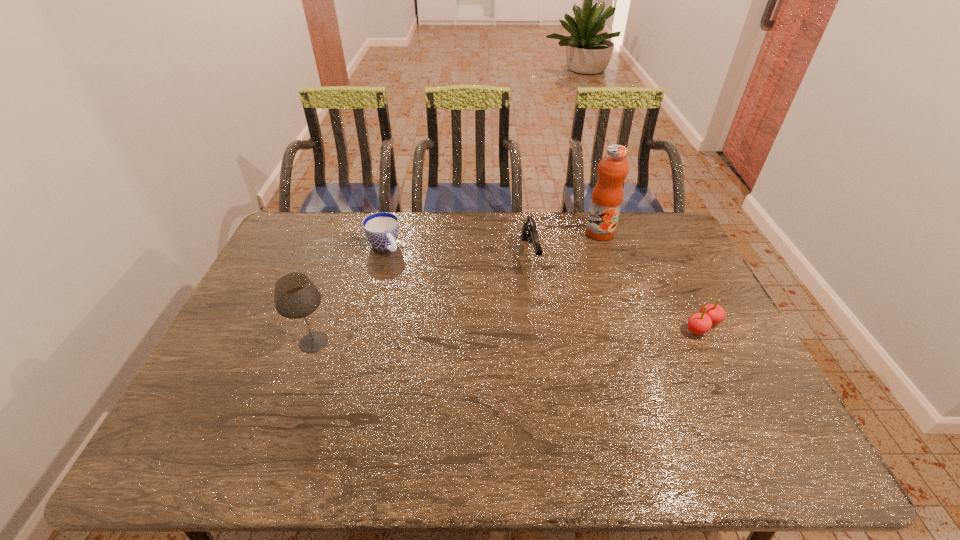
Image resolution: width=960 pixels, height=540 pixels. Find the location of `the leftmost object`. the leftmost object is located at coordinates (295, 296).

The height and width of the screenshot is (540, 960). Find the location of `the second tallest object`. the second tallest object is located at coordinates (295, 296).

Identify the location of the rightmost object. This screenshot has width=960, height=540. [x=699, y=323].

The height and width of the screenshot is (540, 960). I want to click on the third tallest object, so click(529, 231).

You are a GUI agent. You are given a task and a screenshot of the screen. Output one action in this format:
    pyautogui.click(x=<x>, y=<y>)
    Task: Click on the gun
    This screenshot has width=960, height=540.
    Given the screenshot: What is the action you would take?
    pyautogui.click(x=529, y=231)

Locate an element on the screen. Image resolution: width=960 pixels, height=540 pixels. the fourth object from right to left is located at coordinates (381, 229).

The image size is (960, 540). Find the location of `the second object from right to left`. the second object from right to left is located at coordinates (607, 196).

Locate an element on the screen. Image resolution: width=960 pixels, height=540 pixels. fruit juice is located at coordinates (607, 196).

Image resolution: width=960 pixels, height=540 pixels. Find the location of `vacant region located 0.320m on the right of the wineglass`. vacant region located 0.320m on the right of the wineglass is located at coordinates (448, 342).

Find the location of a particular element. This screenshot has height=540, width=960. blank space located 0.390m on the back of the rightmost object is located at coordinates (658, 235).